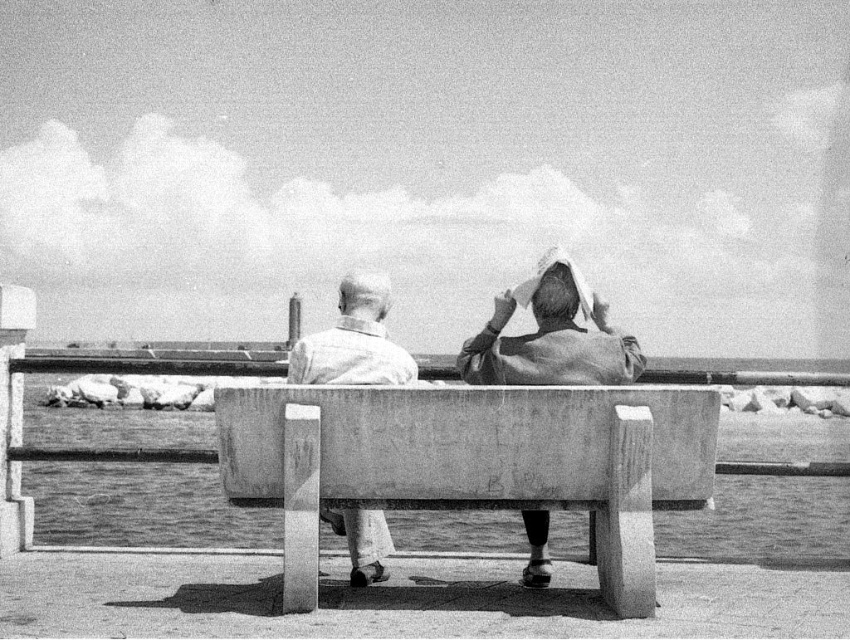
You are designing a new clothing rack that can display both the smooth leather jacket at center and the smooth white shirt at center. The rack has two hangers, one for each item. If the rack has limited space, which item requires a larger hanger based on their sizes?

The smooth leather jacket at center requires a larger hanger because it has a larger size compared to the smooth white shirt at center.

You are designing a new bench for a public park and want to ensure it can accommodate both the smooth concrete bench at center and the smooth white shirt at center comfortably. Based on the image, which object has a greater width, and why?

The smooth concrete bench at center has a greater width than the smooth white shirt at center because the description states that the smooth concrete bench at center is wider than the smooth white shirt at center.